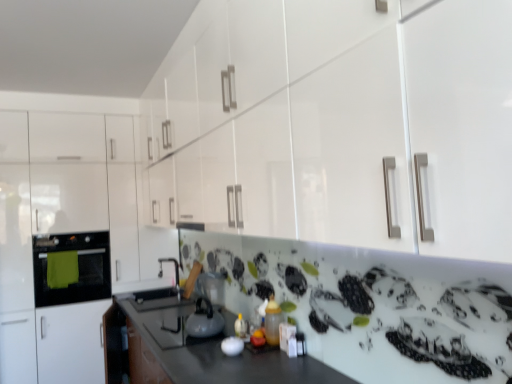
The width and height of the screenshot is (512, 384). Identify the location of free space above matte black oven at left (from a real-world perspective). (70, 228).